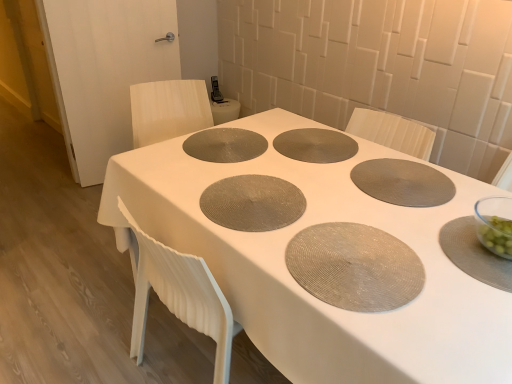
Locate an element on the screen. vacant space situated above matte gray placemat at center, the second oval in the bottom-to-top sequence (from a real-world perspective) is located at coordinates (221, 141).